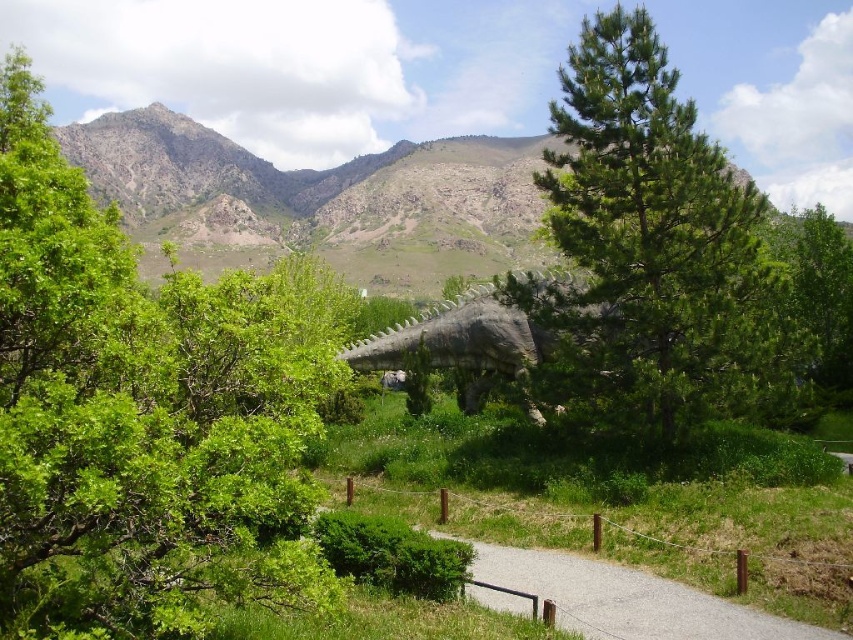
Question: Which of the following is the farthest from the observer?

Choices:
 (A) green needle-like at center
 (B) green leafy tree at upper left
 (C) rugged stone mountain at center
 (D) gray gravel path at center

Answer: (C)

Question: Can you confirm if green needle-like at center is wider than rugged stone mountain at center?

Choices:
 (A) yes
 (B) no

Answer: (B)

Question: Is green leafy tree at upper left to the right of gray gravel path at center from the viewer's perspective?

Choices:
 (A) yes
 (B) no

Answer: (B)

Question: Among these objects, which one is farthest from the camera?

Choices:
 (A) gray gravel path at center
 (B) green leafy tree at upper left
 (C) rugged stone mountain at center

Answer: (C)

Question: Can you confirm if green needle-like at center is positioned to the left of gray gravel path at center?

Choices:
 (A) yes
 (B) no

Answer: (B)

Question: Which point is farther from the camera taking this photo?

Choices:
 (A) (646, 621)
 (B) (485, 262)

Answer: (B)